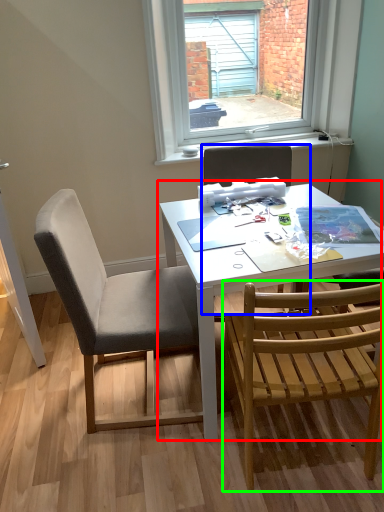
Question: Which is farther away from table (highlighted by a red box)? chair (highlighted by a blue box) or chair (highlighted by a green box)?

Choices:
 (A) chair
 (B) chair

Answer: (A)